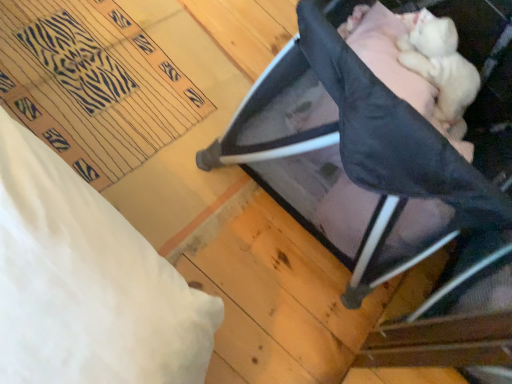
Question: In the image, is white fluffy newborn at upper right on the left side or the right side of black mesh playpen at upper right?

Choices:
 (A) left
 (B) right

Answer: (B)

Question: Is point (449, 115) positioned closer to the camera than point (223, 135)?

Choices:
 (A) farther
 (B) closer

Answer: (A)

Question: Considering the positions of white fluffy newborn at upper right and black mesh playpen at upper right in the image, is white fluffy newborn at upper right taller or shorter than black mesh playpen at upper right?

Choices:
 (A) short
 (B) tall

Answer: (A)

Question: In terms of size, does black mesh playpen at upper right appear bigger or smaller than white fluffy newborn at upper right?

Choices:
 (A) big
 (B) small

Answer: (A)

Question: In terms of height, does black mesh playpen at upper right look taller or shorter compared to white fluffy newborn at upper right?

Choices:
 (A) short
 (B) tall

Answer: (B)

Question: Is point (459, 19) positioned closer to the camera than point (436, 29)?

Choices:
 (A) farther
 (B) closer

Answer: (A)

Question: Do you think black mesh playpen at upper right is within white fluffy newborn at upper right, or outside of it?

Choices:
 (A) inside
 (B) outside

Answer: (B)